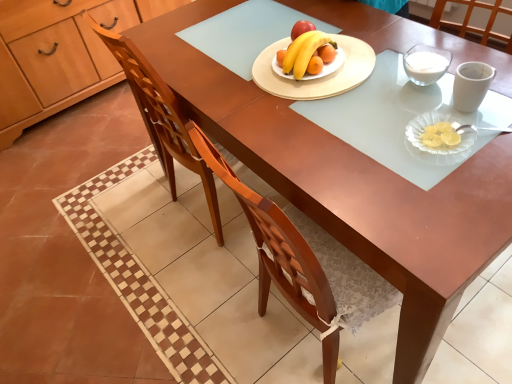
Locate an element on the screen. free region on the left part of wooden chair at center is located at coordinates (127, 213).